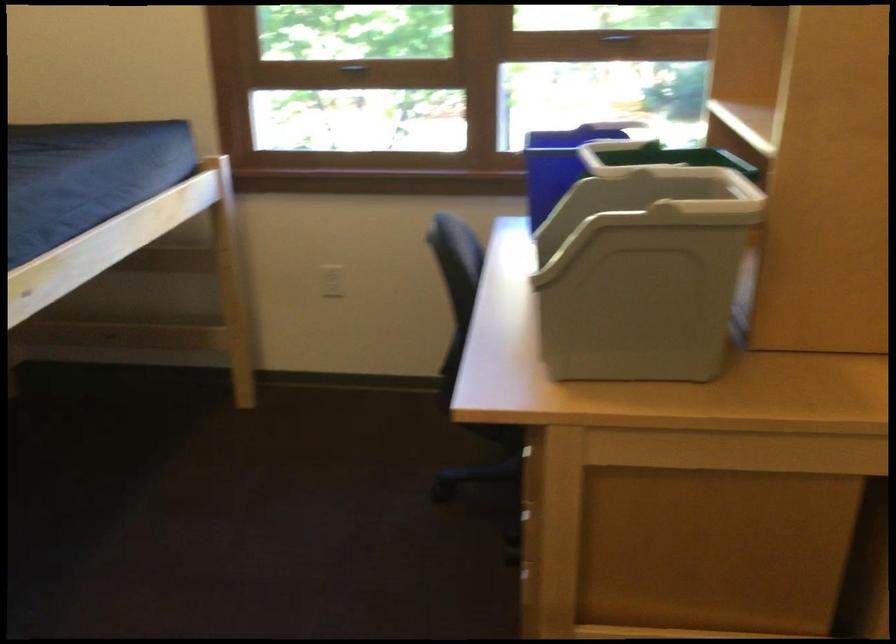
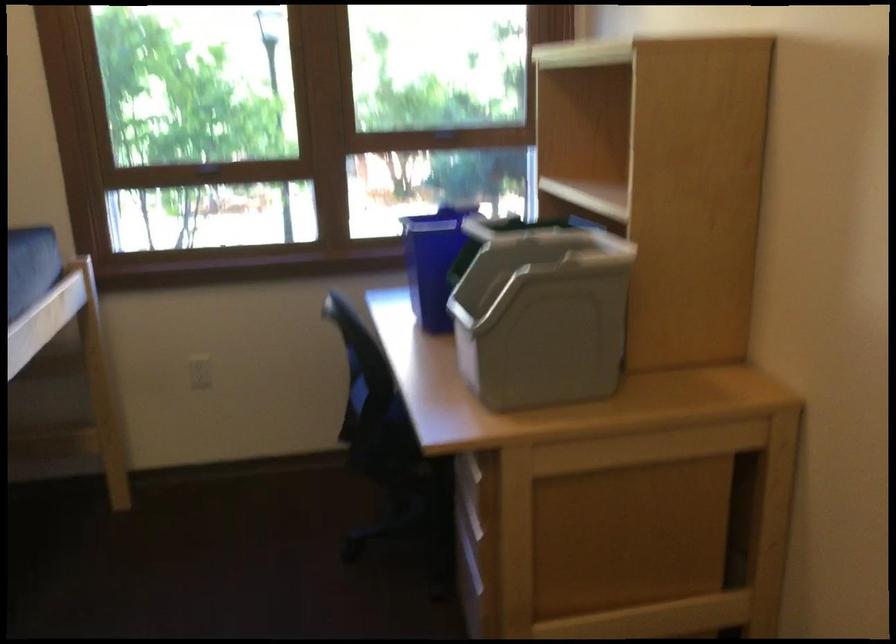
Where in the second image is the point corresponding to point 326,283 from the first image?

(200, 372)